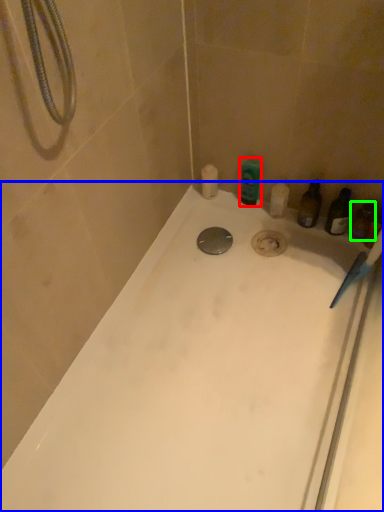
Question: Which is farther away from toiletry (highlighted by a red box)? bathtub (highlighted by a blue box) or toiletry (highlighted by a green box)?

Choices:
 (A) bathtub
 (B) toiletry

Answer: (A)